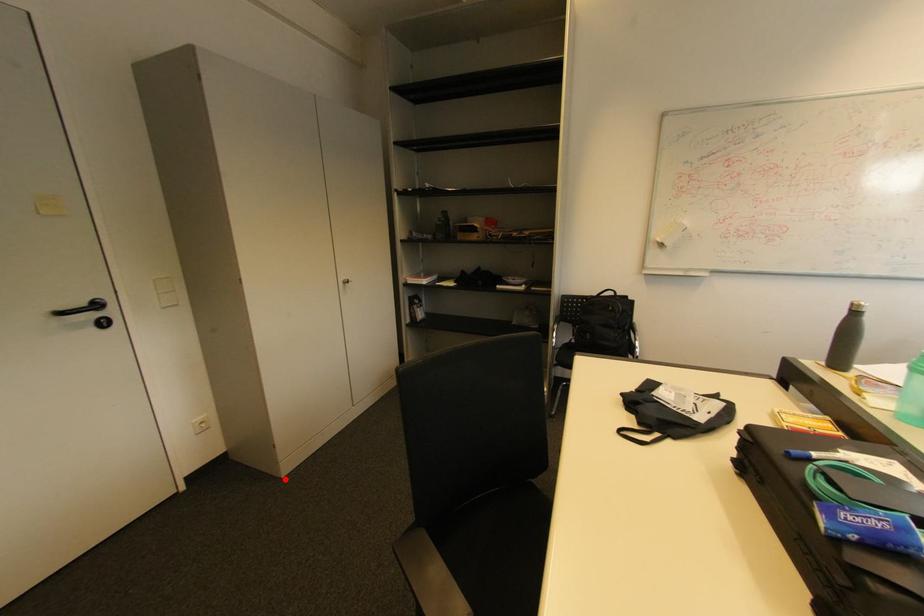
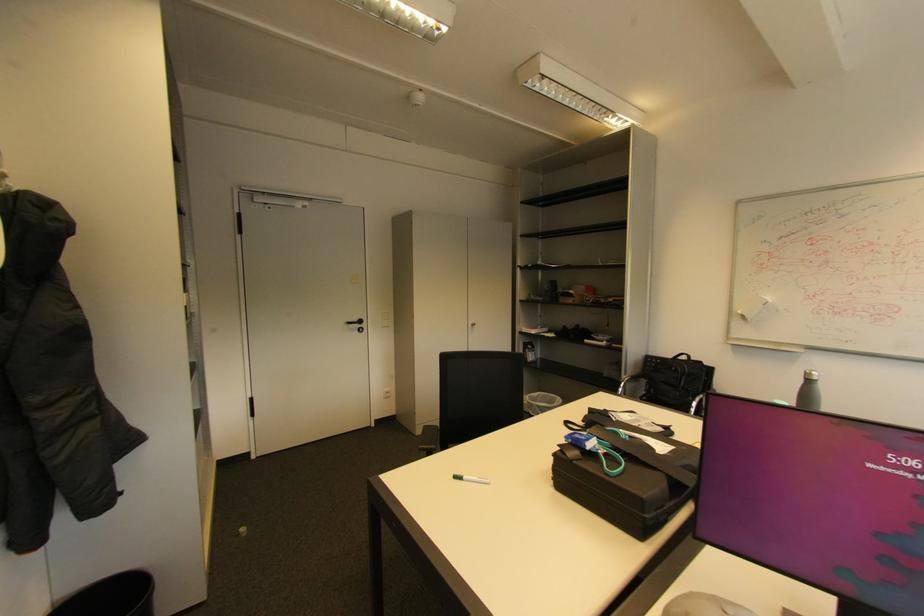
The point at the highlighted location is marked in the first image. Where is the corresponding point in the second image?

(420, 436)